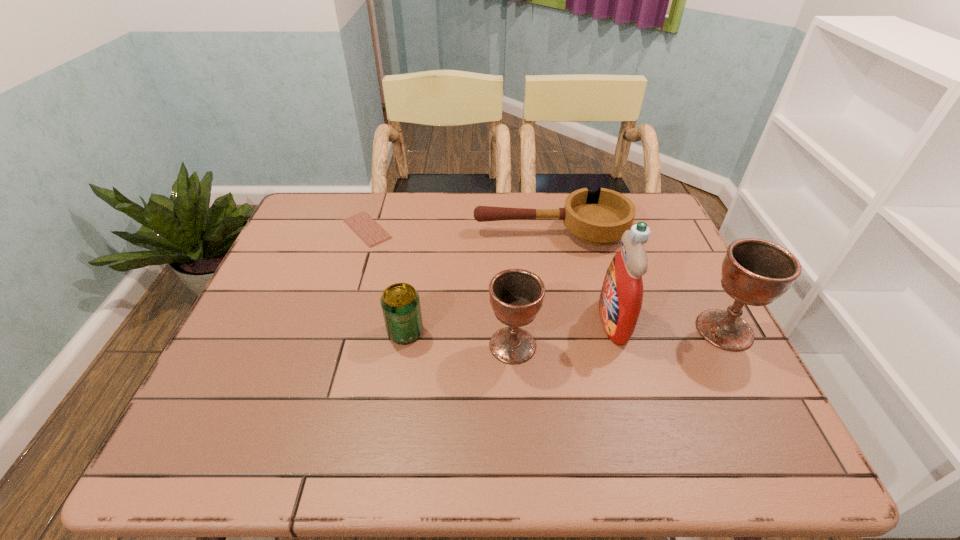
Locate an element on the screen. the third tallest object is located at coordinates (516, 296).

The height and width of the screenshot is (540, 960). Identify the location of the left chalice. (516, 296).

Where is `the rightmost object`? The width and height of the screenshot is (960, 540). the rightmost object is located at coordinates (755, 272).

You are a GUI agent. You are given a task and a screenshot of the screen. Output one action in this format:
    pyautogui.click(x=<x>, y=<y>)
    Task: Click on the right chalice
    
    Given the screenshot: What is the action you would take?
    pyautogui.click(x=755, y=272)

The image size is (960, 540). I want to click on saucepan, so click(x=599, y=218).

Image resolution: width=960 pixels, height=540 pixels. What are the coordinates of `detergent` in the screenshot? It's located at (620, 302).

You are a GUI agent. You are given a task and a screenshot of the screen. Output one action in this format:
    pyautogui.click(x=<x>, y=<y>)
    Task: Click on the chocolate bar
    This screenshot has height=540, width=960.
    Given the screenshot: What is the action you would take?
    pyautogui.click(x=362, y=224)

What are the coordinates of `the shortest object` in the screenshot? It's located at (362, 224).

The width and height of the screenshot is (960, 540). Find the location of `the fifth object from right to left`. the fifth object from right to left is located at coordinates (400, 302).

Image resolution: width=960 pixels, height=540 pixels. What are the coordinates of `the fourth tallest object` in the screenshot? It's located at (400, 302).